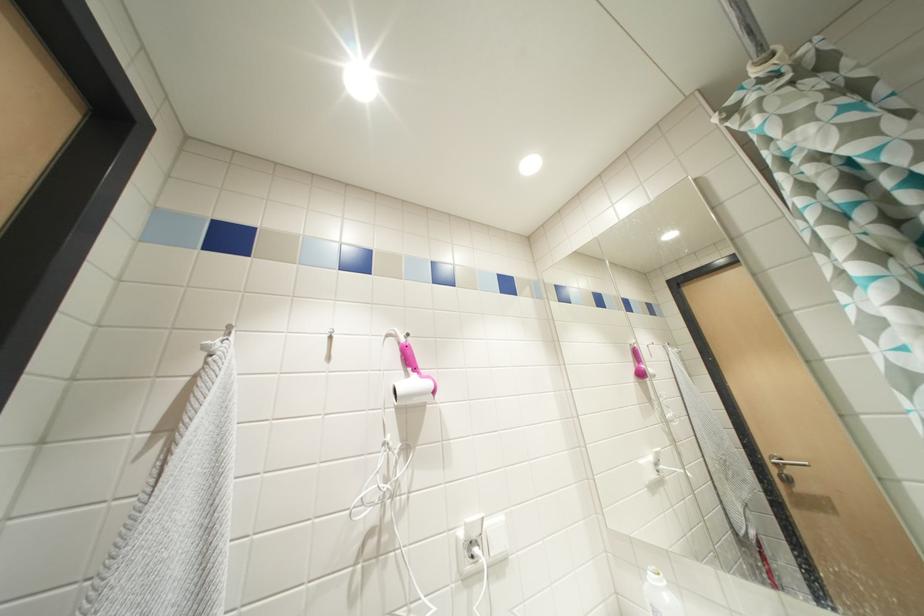
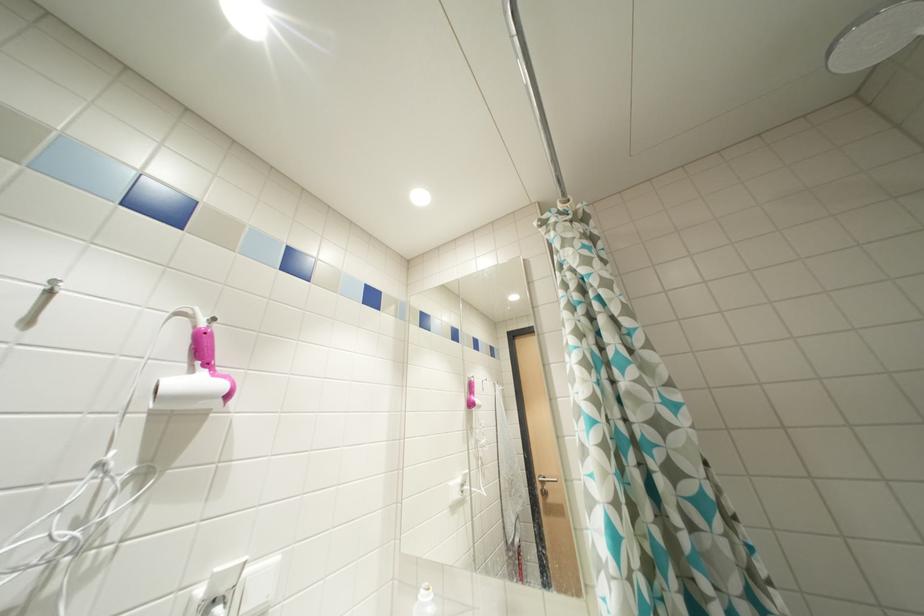
Question: Based on the continuous images, in which direction is the camera rotating? Reply with the corresponding letter.

Choices:
 (A) Left
 (B) Right
 (C) Up
 (D) Down

Answer: (B)